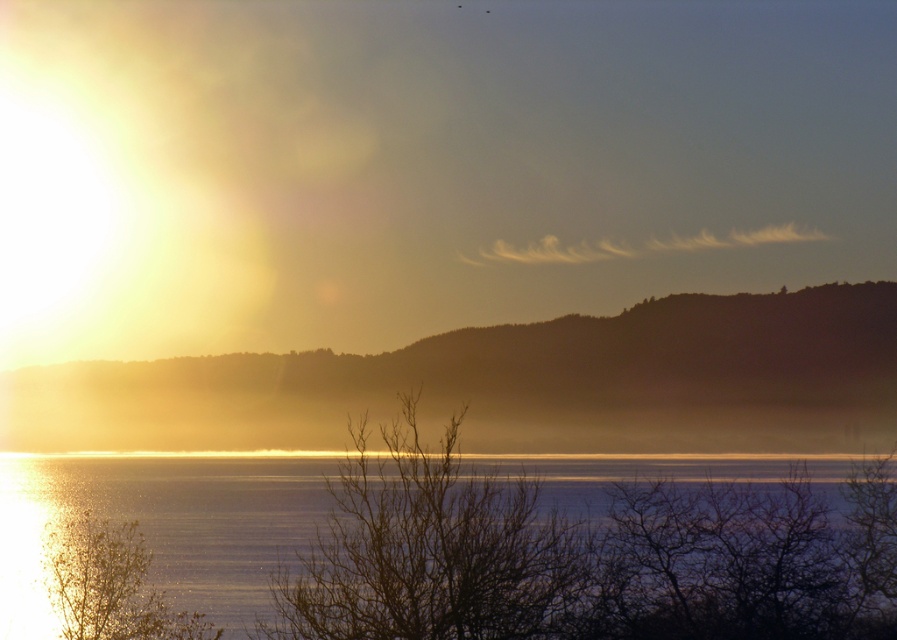
You are standing at the point labeled point (172, 512) and want to walk to the point labeled point (511, 596). Which direction should you face to move towards your destination?

You should face towards the right and slightly upwards because point (511, 596) is located to the right and above point (172, 512).

You are a photographer standing at the edge of the water in the scene. You want to take a photo that includes both the point at coordinates point (x=814, y=442) and point (x=377, y=605). Which point will appear closer to the bottom edge of your camera viewfinder?

Point (x=377, y=605) will appear closer to the bottom edge of the camera viewfinder because it is farther from the camera compared to point (x=814, y=442), which is closer to the camera.

You are standing at the point marked by the coordinates point [514,385] in the image. Looking around, you see the serene sunrise or sunset over the water with mountains in the background. Can you describe the immediate surroundings of your location based on the scene?

The point [514,385] is on the foggy horizon at center, so your immediate surroundings are part of the foggy horizon where the mountains and the water meet in the distance.